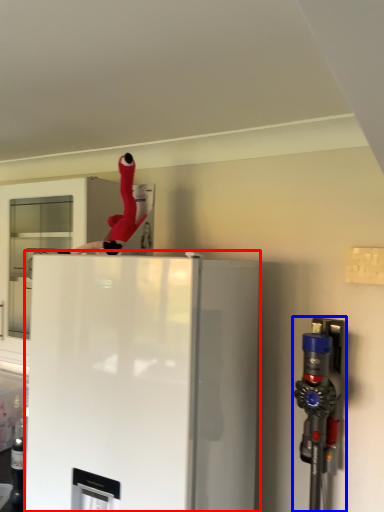
Question: Which point is further to the camera, refrigerator (highlighted by a red box) or appliance (highlighted by a blue box)?

Choices:
 (A) refrigerator
 (B) appliance

Answer: (B)